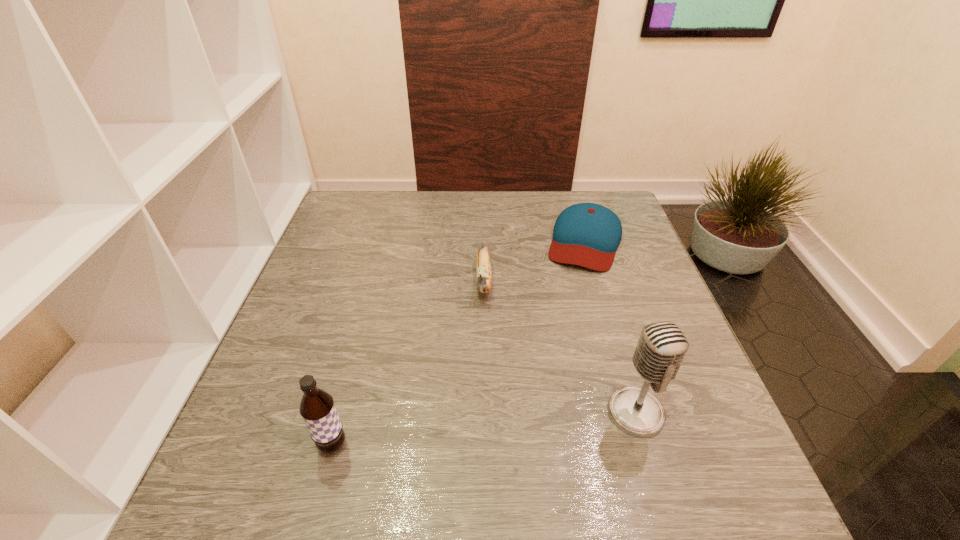
Where is `vacant region that satisfies the following two spatial constraints: 1. on the back side of the microphone; 2. on the left side of the baseball cap`? vacant region that satisfies the following two spatial constraints: 1. on the back side of the microphone; 2. on the left side of the baseball cap is located at coordinates (585, 241).

You are a GUI agent. You are given a task and a screenshot of the screen. Output one action in this format:
    pyautogui.click(x=<x>, y=<y>)
    Task: Click on the free spot that satisfies the following two spatial constraints: 1. on the back side of the baseball cap; 2. on the left side of the leftmost object
    
    Given the screenshot: What is the action you would take?
    pyautogui.click(x=387, y=241)

Where is `free space in the image that satisfies the following two spatial constraints: 1. on the back side of the microphone; 2. on the right side of the root beer`? The image size is (960, 540). free space in the image that satisfies the following two spatial constraints: 1. on the back side of the microphone; 2. on the right side of the root beer is located at coordinates (342, 413).

Where is `free space that satisfies the following two spatial constraints: 1. on the back side of the microphone; 2. on the right side of the shortest object`? This screenshot has width=960, height=540. free space that satisfies the following two spatial constraints: 1. on the back side of the microphone; 2. on the right side of the shortest object is located at coordinates click(585, 241).

This screenshot has height=540, width=960. Identify the location of vacant space that satisfies the following two spatial constraints: 1. on the back side of the leftmost object; 2. on the right side of the banana. (377, 280).

Where is `vacant space that satisfies the following two spatial constraints: 1. on the front side of the tallest object; 2. on the right side of the third tallest object`? The width and height of the screenshot is (960, 540). vacant space that satisfies the following two spatial constraints: 1. on the front side of the tallest object; 2. on the right side of the third tallest object is located at coordinates (486, 413).